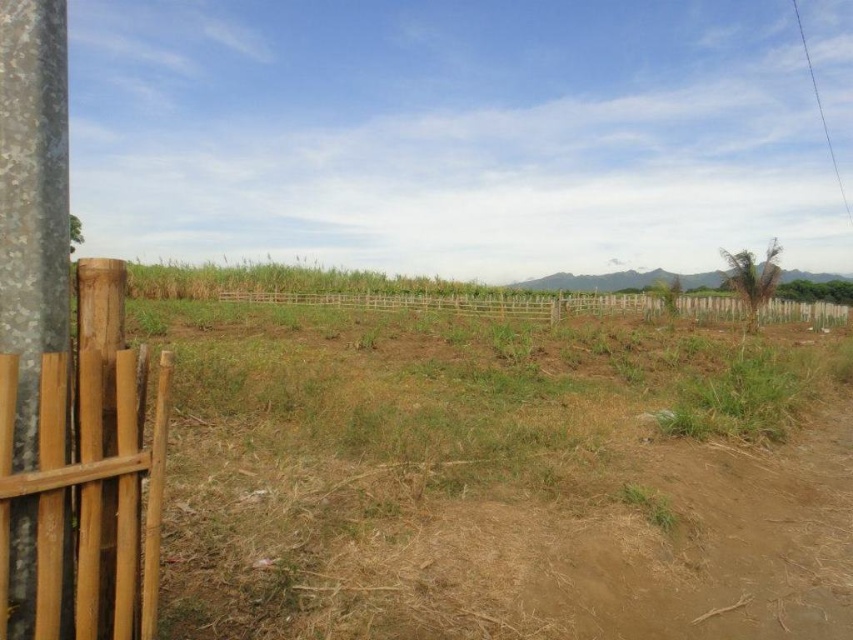
Measure the distance between galvanized metal pole at left and brown wooden fence at left.

galvanized metal pole at left and brown wooden fence at left are 8.08 inches apart.

Which is in front, point (56, 330) or point (57, 493)?

Point (57, 493) is more forward.

Find the location of a particular element. This screenshot has width=853, height=640. galvanized metal pole at left is located at coordinates (32, 198).

From the picture: Can you confirm if galvanized metal pole at left is wider than brown wooden fence at center?

No, galvanized metal pole at left is not wider than brown wooden fence at center.

Between galvanized metal pole at left and brown wooden fence at center, which one has more height?

brown wooden fence at center

You are a GUI agent. You are given a task and a screenshot of the screen. Output one action in this format:
    pyautogui.click(x=<x>, y=<y>)
    Task: Click on the galvanized metal pole at left
    The height and width of the screenshot is (640, 853).
    Given the screenshot: What is the action you would take?
    pyautogui.click(x=32, y=198)

This screenshot has height=640, width=853. I want to click on galvanized metal pole at left, so click(x=32, y=198).

Who is positioned more to the right, brown dry soil at center or brown wooden fence at center?

From the viewer's perspective, brown wooden fence at center appears more on the right side.

Who is more distant from viewer, (x=247, y=477) or (x=780, y=298)?

The point (x=780, y=298) is behind.

Locate an element on the screen. brown dry soil at center is located at coordinates (500, 477).